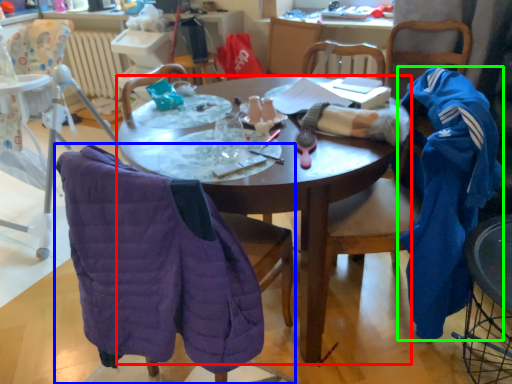
Question: Based on their relative distances, which object is nearer to desk (highlighted by a red box)? Choose from chair (highlighted by a blue box) and clothing (highlighted by a green box).

Choices:
 (A) chair
 (B) clothing

Answer: (A)